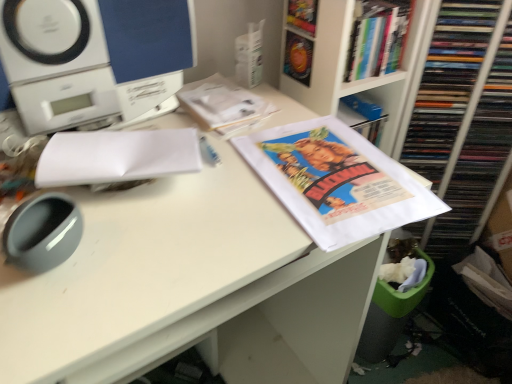
You are a GUI agent. You are given a task and a screenshot of the screen. Output one action in this format:
    pyautogui.click(x=<x>, y=<y>)
    Task: Click on the free location in front of white paper at left
    
    Given the screenshot: What is the action you would take?
    pos(128,262)